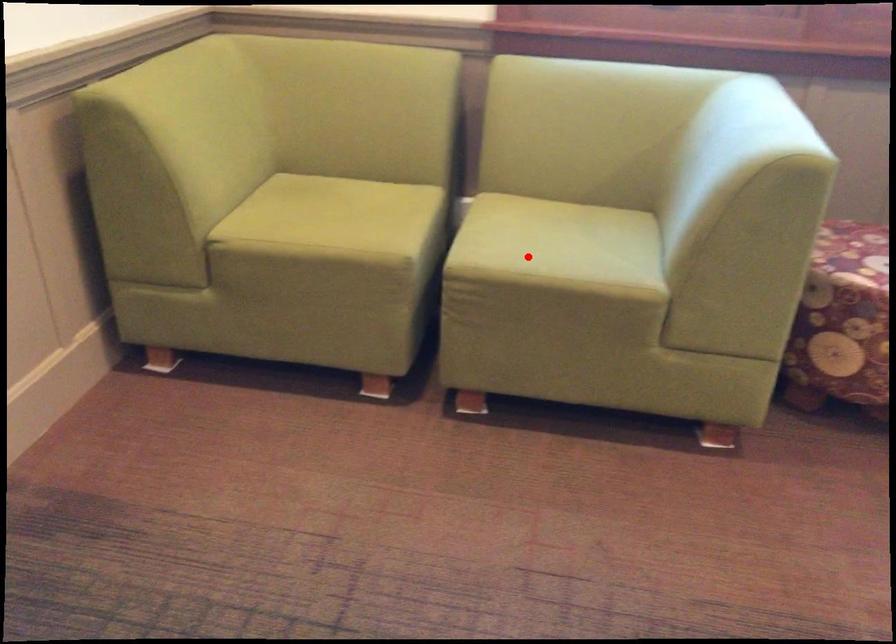
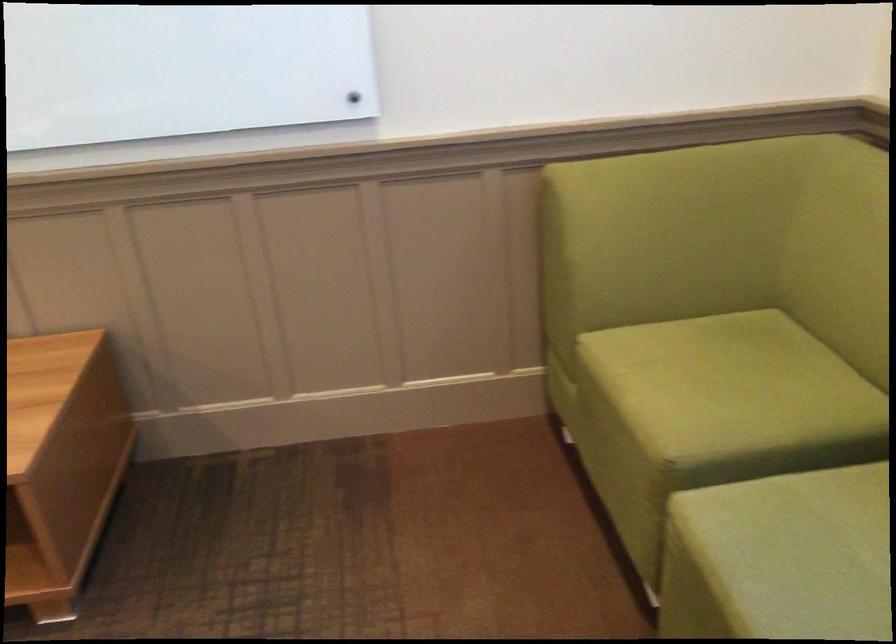
Question: A red point is marked in image1. In image2, is the corresponding 3D point closer to the camera or farther? Reply with the corresponding letter.

Choices:
 (A) The corresponding 3D point is closer.
 (B) The corresponding 3D point is farther.

Answer: (A)